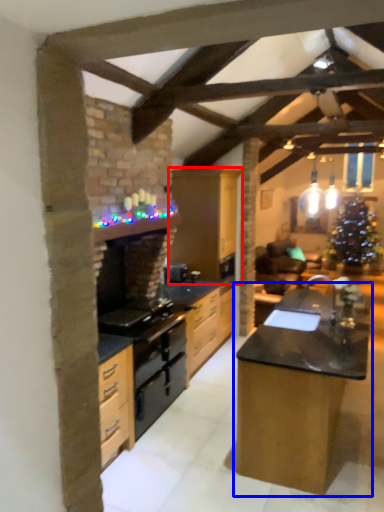
Question: Among these objects, which one is nearest to the camera, cabinetry (highlighted by a red box) or table (highlighted by a blue box)?

Choices:
 (A) cabinetry
 (B) table

Answer: (B)